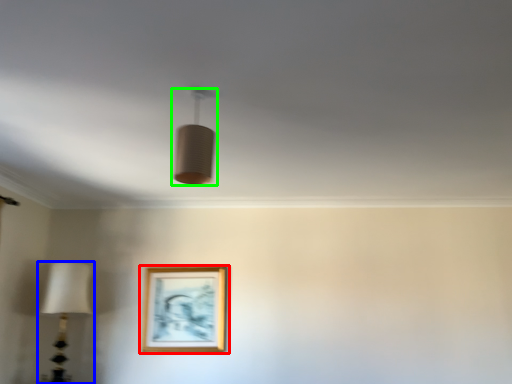
Question: Estimate the real-world distances between objects in this image. Which object is farther from picture frame (highlighted by a red box), lamp (highlighted by a blue box) or lamp (highlighted by a green box)?

Choices:
 (A) lamp
 (B) lamp

Answer: (B)